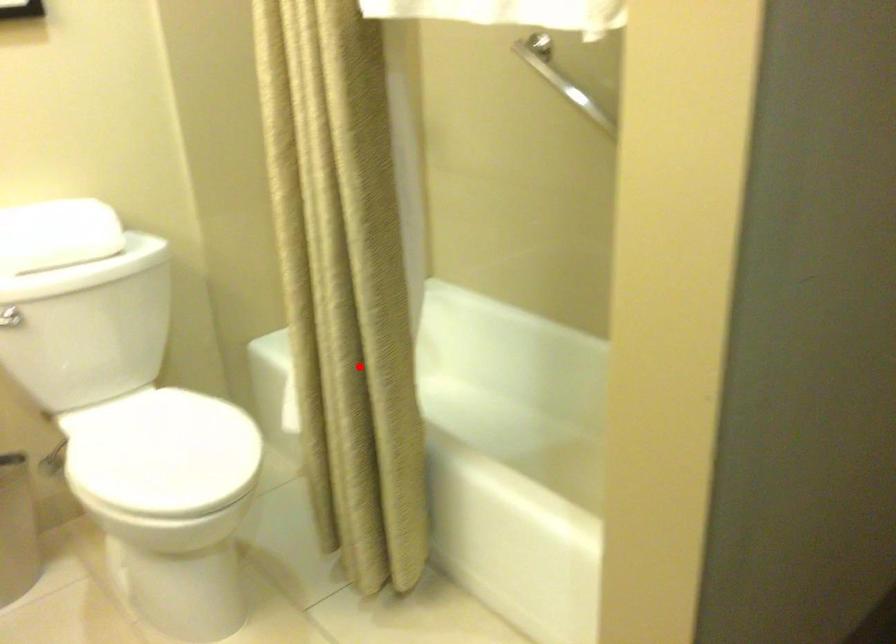
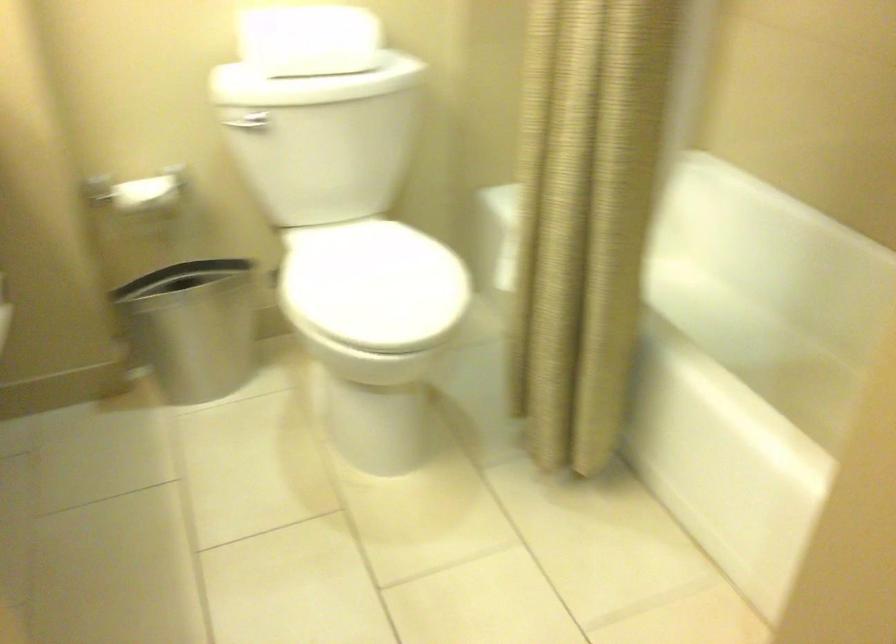
Question: A red point is marked in image1. In image2, is the corresponding 3D point closer to the camera or farther? Reply with the corresponding letter.

Choices:
 (A) The corresponding 3D point is closer.
 (B) The corresponding 3D point is farther.

Answer: (A)